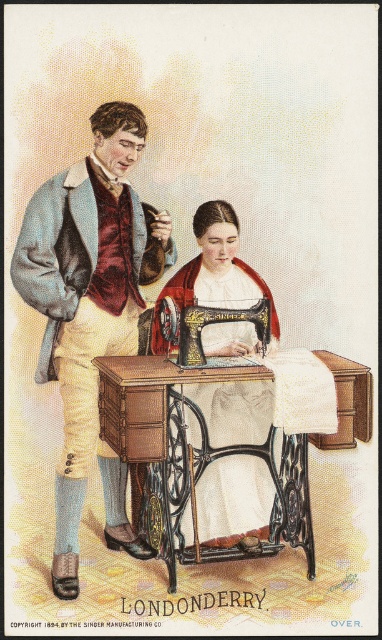
Question: Which point appears farthest from the camera in this image?

Choices:
 (A) (197, 342)
 (B) (64, 545)

Answer: (B)

Question: Can you confirm if light blue wool coat at left is thinner than black wrought iron sewing machine at center?

Choices:
 (A) yes
 (B) no

Answer: (A)

Question: Can you confirm if matte black sewing machine at center is positioned above black cast iron sewing machine at center?

Choices:
 (A) yes
 (B) no

Answer: (B)

Question: Among these objects, which one is farthest from the camera?

Choices:
 (A) light blue wool coat at left
 (B) black cast iron sewing machine at center
 (C) black wrought iron sewing machine at center

Answer: (A)

Question: Which point is closer to the camera taking this photo?

Choices:
 (A) (189, 321)
 (B) (194, 416)

Answer: (A)

Question: In this image, where is light blue wool coat at left located relative to matte black sewing machine at center?

Choices:
 (A) below
 (B) above

Answer: (B)